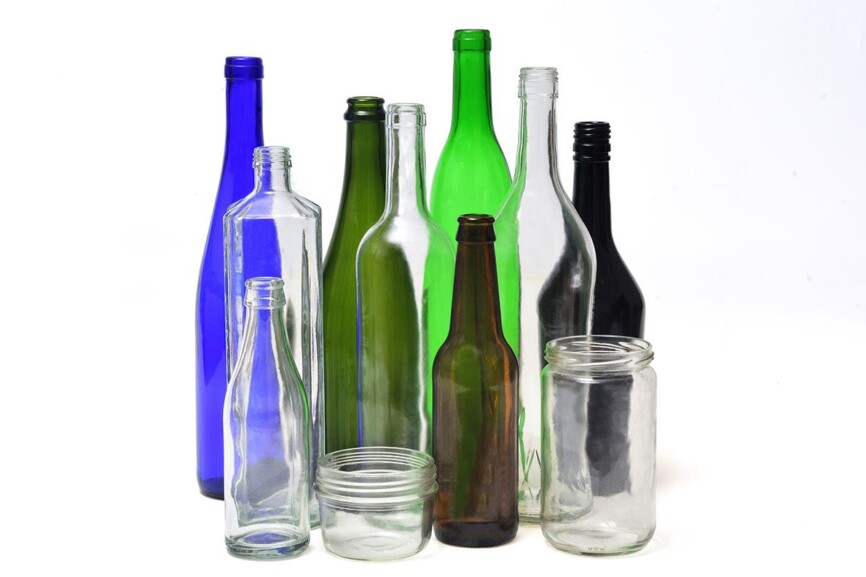
The height and width of the screenshot is (577, 866). I want to click on clear glassware, so (255, 402), (265, 249), (411, 246), (356, 493), (596, 406).